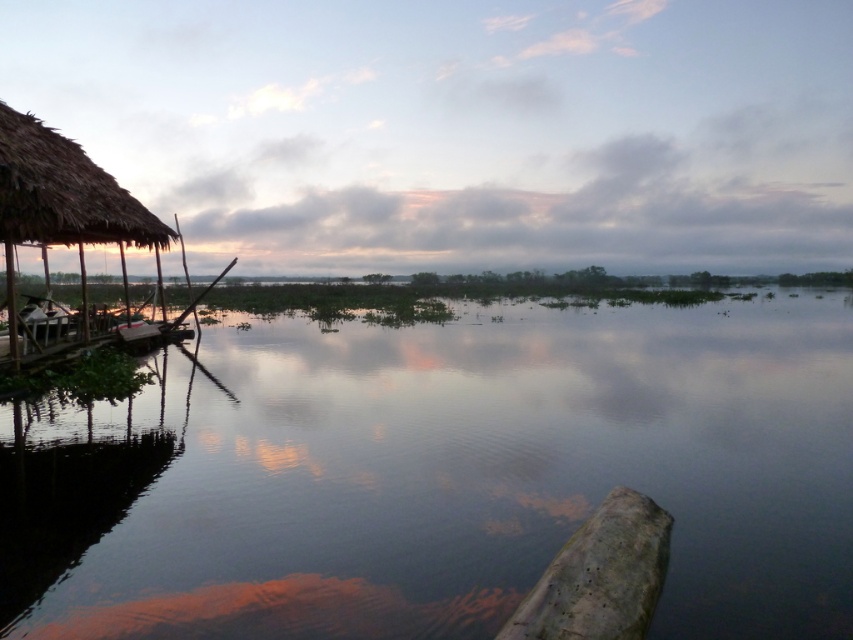
You are planning to build a small floating platform in the serene lakeside scene. The platform needs to be placed where the transparent water at center is located. Considering the size of the transparent water area compared to the thatched straw hut at left, will the platform fit comfortably without overlapping the hut?

The transparent water at center is larger in size than the thatched straw hut at left, so the platform can fit comfortably in the transparent water area without overlapping the hut.